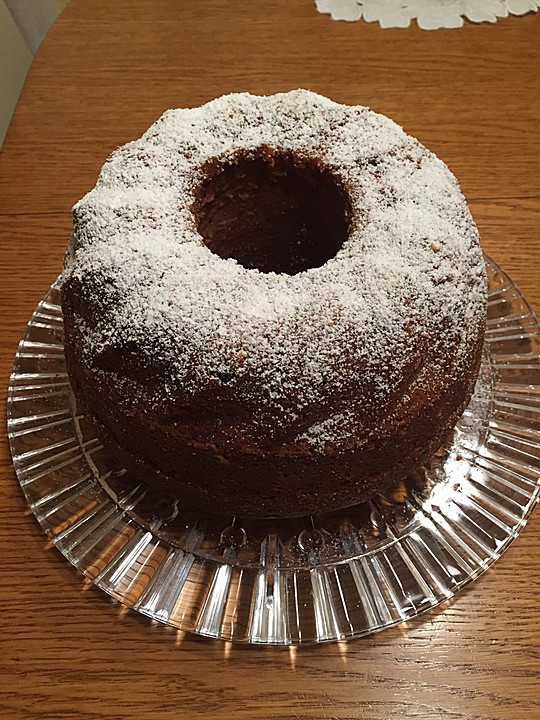
This screenshot has width=540, height=720. Find the location of `dessert plate`. dessert plate is located at coordinates (320, 608).